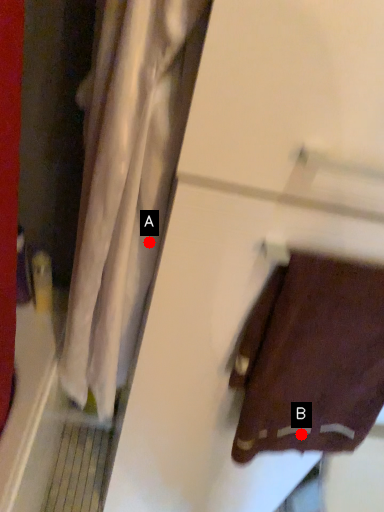
Question: Two points are circled on the image, labeled by A and B beside each circle. Which point is closer to the camera?

Choices:
 (A) A is closer
 (B) B is closer

Answer: (A)